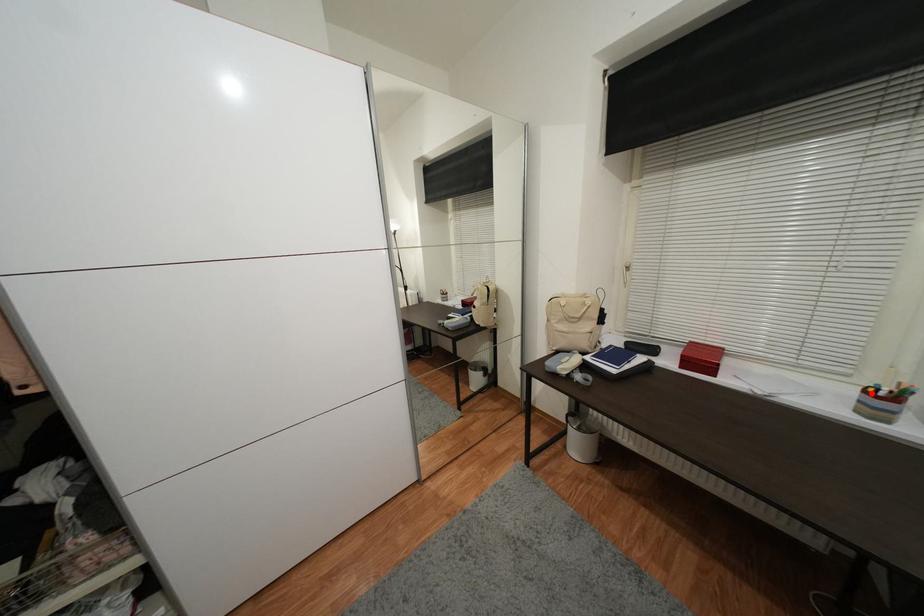
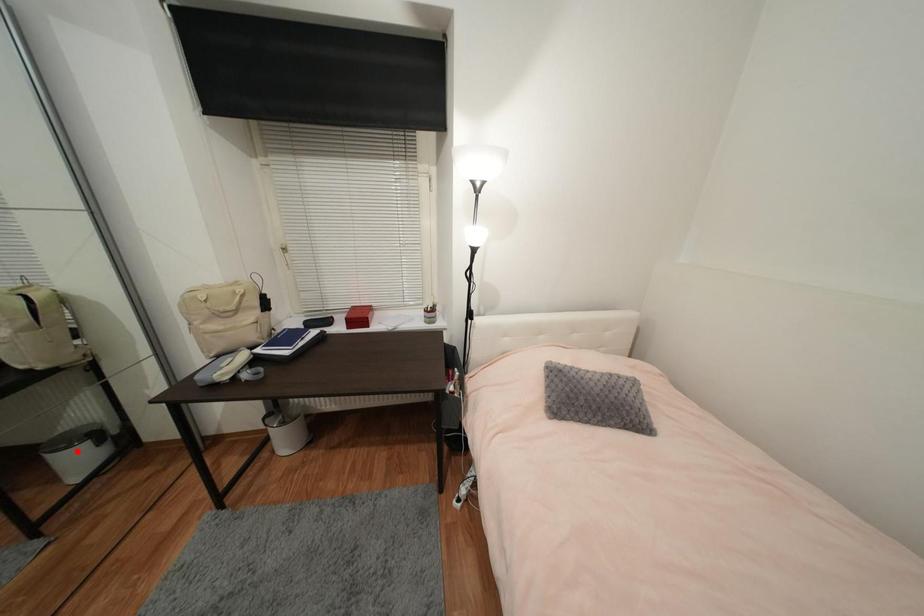
I am providing you with two images of the same scene from different viewpoints. A red point is marked on the first image and another point is marked on the second image. Is the marked point in image1 the same physical position as the marked point in image2?

No